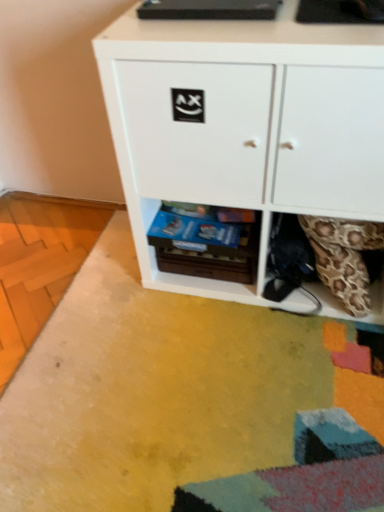
At what (x,y) coordinates should I click in order to perform the action: click on free space that is to the left of white matte cabinet at center. Please return your answer as a coordinate pair (x, y). The width and height of the screenshot is (384, 512). Looking at the image, I should click on (109, 326).